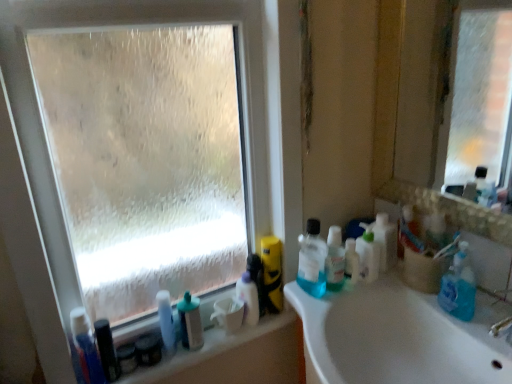
Question: Is white glossy sink at center bigger than transparent frosted glass at upper left?

Choices:
 (A) no
 (B) yes

Answer: (B)

Question: Is white glossy sink at center at the left side of transparent frosted glass at upper left?

Choices:
 (A) yes
 (B) no

Answer: (B)

Question: Does white glossy sink at center have a greater width compared to transparent frosted glass at upper left?

Choices:
 (A) no
 (B) yes

Answer: (B)

Question: From the image's perspective, is white glossy sink at center on transparent frosted glass at upper left?

Choices:
 (A) no
 (B) yes

Answer: (A)

Question: Is the surface of white glossy sink at center in direct contact with transparent frosted glass at upper left?

Choices:
 (A) yes
 (B) no

Answer: (B)

Question: Based on their sizes in the image, would you say translucent plastic bottle at lower left, positioned as the fourth toiletry in left-to-right order, is bigger or smaller than black plastic toothbrush at lower left, which is counted as the first toiletry, starting from the left?

Choices:
 (A) small
 (B) big

Answer: (B)

Question: Is point (162, 311) positioned closer to the camera than point (117, 372)?

Choices:
 (A) closer
 (B) farther

Answer: (B)

Question: From the image's perspective, relative to black plastic toothbrush at lower left, which is counted as the first toiletry, starting from the left, is translucent plastic bottle at lower left, positioned as the fourth toiletry in left-to-right order, above or below?

Choices:
 (A) below
 (B) above

Answer: (B)

Question: From a real-world perspective, is translucent plastic bottle at lower left, which is counted as the fourth toiletry, starting from the right, positioned above or below black plastic toothbrush at lower left, arranged as the seventh toiletry when viewed from the right?

Choices:
 (A) below
 (B) above

Answer: (B)

Question: From the image's perspective, is matte black container at lower left, positioned as the sixth toiletry in right-to-left order, located above or below white plastic bottles at lower left?

Choices:
 (A) above
 (B) below

Answer: (A)

Question: Is matte black container at lower left, acting as the 2th toiletry starting from the left, spatially inside white plastic bottles at lower left, or outside of it?

Choices:
 (A) outside
 (B) inside

Answer: (A)

Question: Considering the positions of matte black container at lower left, positioned as the sixth toiletry in right-to-left order, and white plastic bottles at lower left in the image, is matte black container at lower left, positioned as the sixth toiletry in right-to-left order, taller or shorter than white plastic bottles at lower left?

Choices:
 (A) tall
 (B) short

Answer: (A)

Question: Considering the positions of matte black container at lower left, acting as the 2th toiletry starting from the left, and white plastic bottles at lower left in the image, is matte black container at lower left, acting as the 2th toiletry starting from the left, wider or thinner than white plastic bottles at lower left?

Choices:
 (A) thin
 (B) wide

Answer: (A)

Question: From a real-world perspective, relative to translucent plastic mouthwash at right, acting as the first mouthwash starting from the right, is translucent plastic bottles at right, acting as the second cleaning product starting from the right, vertically above or below?

Choices:
 (A) above
 (B) below

Answer: (A)

Question: Is translucent plastic bottles at right, acting as the second cleaning product starting from the right, wider or thinner than translucent plastic mouthwash at right, placed as the first mouthwash when sorted from top to bottom?

Choices:
 (A) thin
 (B) wide

Answer: (B)